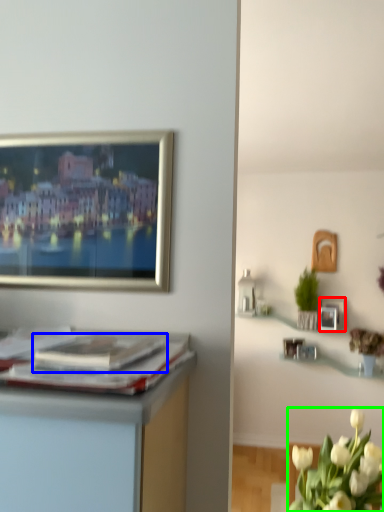
Question: Based on their relative distances, which object is farther from picture frame (highlighted by a red box)? Choose from magazine (highlighted by a blue box) and flower (highlighted by a green box).

Choices:
 (A) magazine
 (B) flower

Answer: (A)